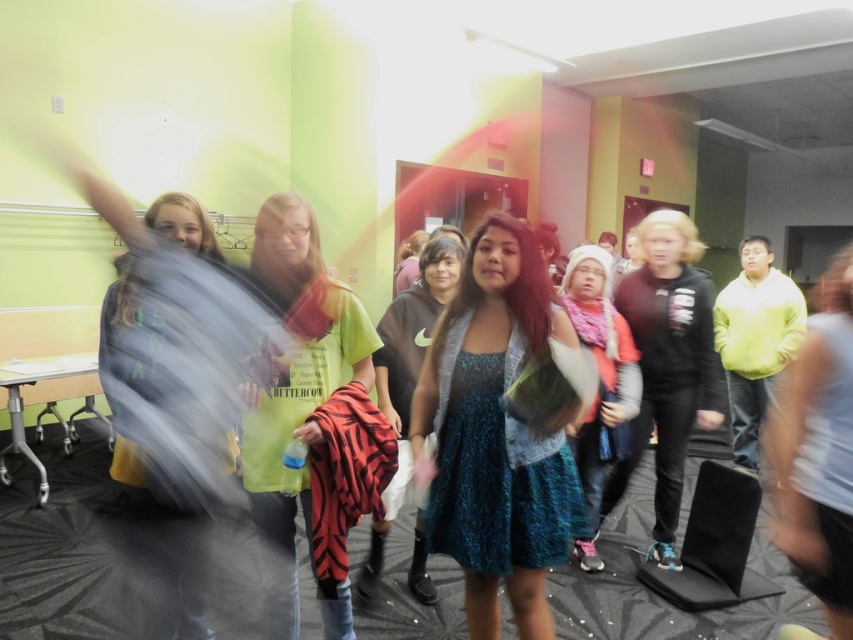
You are a photographer standing at the entrance of the classroom. You want to take a clear photo of the blue sequined dress at center. Considering the current distance, should you move closer or farther away to ensure the dress is in focus?

The blue sequened dress at center is 1.98 meters away from the camera. To ensure it is in focus, you should move closer to reduce the distance between the camera and the dress.

You are a photographer at the event and want to ensure both the blue sequined dress at center and the knitted pink scarf at center are clearly visible in your photo. Given their sizes, which object might require more space in the frame to capture its details?

The blue sequined dress at center is larger in size than the knitted pink scarf at center, so it would require more space in the frame to capture its details.